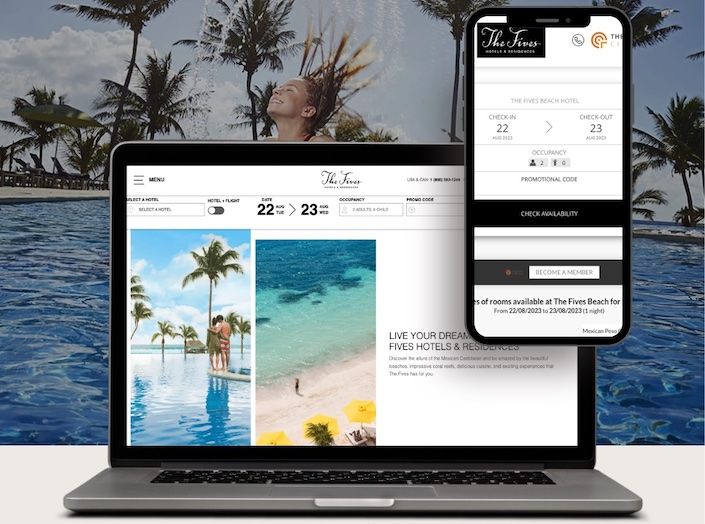
What are the coordinates of `table that laptop rests on` in the screenshot? It's located at (37, 471).